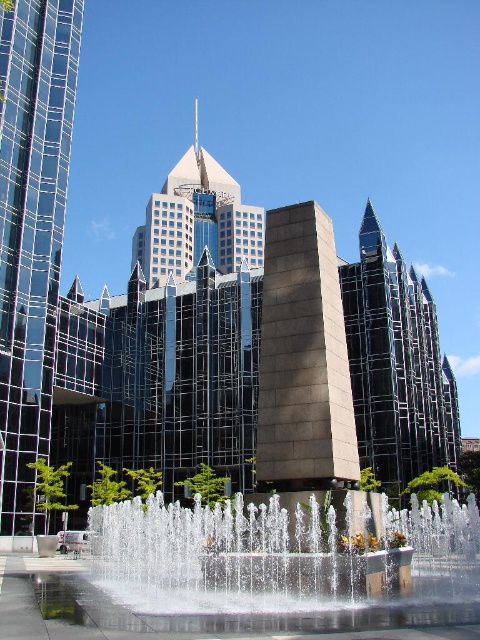
You are a drone operator who needs to fly a drone from the fountain to the glassy steel tower at center. The drone has a maximum flight range of 30 meters. Can you reach the tower without needing to recharge?

The distance between the fountain and the glassy steel tower at center is 32.26 meters, which exceeds the drone operator maximum flight range of 30 meters. Therefore, the drone cannot reach the tower without recharging.

From the picture: You are a city planner evaluating the urban layout. You notice the glassy steel tower at center and the glassy steel skyscraper at center. Which one has a smaller footprint in terms of the area it occupies on the ground?

The glassy steel tower at center has a smaller size compared to the glassy steel skyscraper at center, so it has a smaller footprint on the ground.